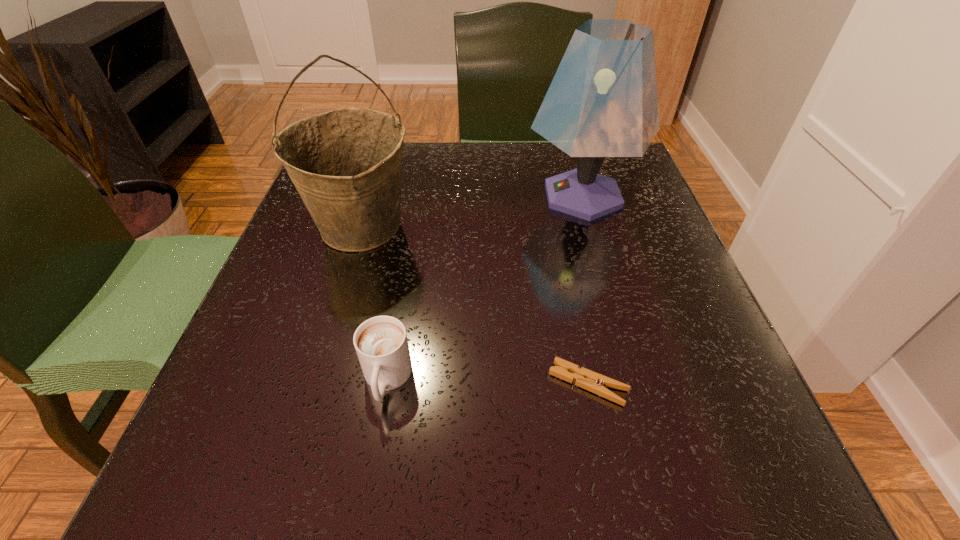
Locate an element on the screen. The width and height of the screenshot is (960, 540). vacant space at the right edge of the desktop is located at coordinates (696, 366).

Where is `blank area at the far right corner`? blank area at the far right corner is located at coordinates (644, 193).

Find the location of `free space between the shortest object and the cappuccino`. free space between the shortest object and the cappuccino is located at coordinates (488, 382).

The image size is (960, 540). In order to click on free spot between the wine bucket and the third tallest object in this screenshot , I will do `click(374, 303)`.

Identify the location of vacant space that is in between the second shortest object and the wine bucket. Image resolution: width=960 pixels, height=540 pixels. (374, 303).

The width and height of the screenshot is (960, 540). I want to click on vacant area that lies between the lampshade and the clothespin, so click(586, 289).

Locate an element on the screen. free spot between the lampshade and the third tallest object is located at coordinates (485, 288).

This screenshot has width=960, height=540. I want to click on free point between the clothespin and the wine bucket, so click(475, 305).

This screenshot has width=960, height=540. In order to click on empty space that is in between the lampshade and the wine bucket in this screenshot , I will do `click(472, 211)`.

Find the location of a particular element. The width and height of the screenshot is (960, 540). free space between the cappuccino and the wine bucket is located at coordinates pyautogui.click(x=374, y=303).